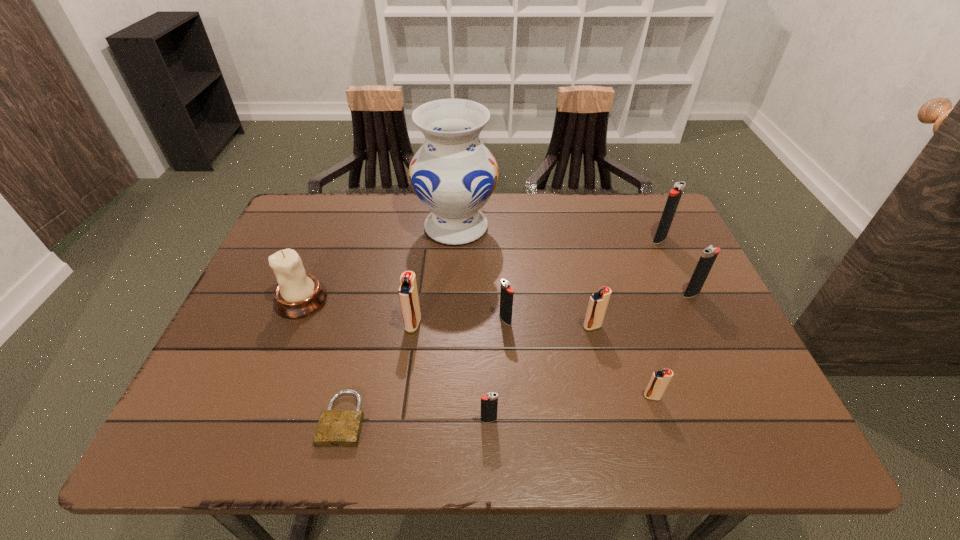
Locate an element on the screen. The height and width of the screenshot is (540, 960). free location located 0.180m on the left of the vase is located at coordinates (353, 227).

Identify the location of vacant region located 0.120m on the left of the farthest black igniter. The image size is (960, 540). (609, 239).

Locate an element on the screen. vacant space situated 0.170m on the right of the candle holder is located at coordinates (397, 300).

The height and width of the screenshot is (540, 960). I want to click on free region located on the left of the leftmost red igniter, so click(x=253, y=324).

Identify the location of free spot located 0.260m on the back of the third nearest black igniter. This screenshot has height=540, width=960. (660, 226).

What are the coordinates of `vacant space located on the right of the second nearest black igniter` in the screenshot? It's located at (661, 320).

Where is `vacant space located 0.090m on the left of the fourth igniter from left to right`? This screenshot has height=540, width=960. vacant space located 0.090m on the left of the fourth igniter from left to right is located at coordinates tap(543, 326).

The width and height of the screenshot is (960, 540). Identify the location of vacant position located 0.370m on the back of the rightmost red igniter. (x=612, y=267).

Find the location of `vacant space located on the left of the nearest igniter`. vacant space located on the left of the nearest igniter is located at coordinates (282, 420).

Image resolution: width=960 pixels, height=540 pixels. Find the location of `vase present at the far edge`. vase present at the far edge is located at coordinates coord(453,174).